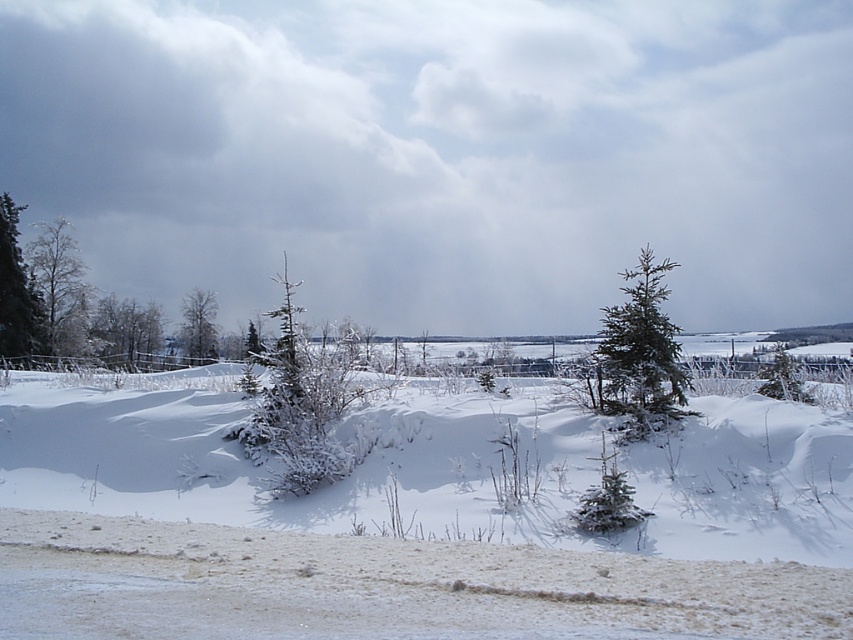
Does green frosted tree at left have a greater width compared to green matte evergreen tree at center-right?

Incorrect, green frosted tree at left's width does not surpass green matte evergreen tree at center-right's.

Who is higher up, green frosted tree at left or green matte evergreen tree at center-right?

Positioned higher is green matte evergreen tree at center-right.

Measure the distance between green frosted tree at left and camera.

green frosted tree at left is 70.23 feet from camera.

The height and width of the screenshot is (640, 853). Identify the location of green frosted tree at left. (128, 333).

Is snow-covered evergreen at center to the left of green matte tree at center from the viewer's perspective?

In fact, snow-covered evergreen at center is to the right of green matte tree at center.

Is snow-covered evergreen at center thinner than green matte tree at center?

No.

Does point (297, 362) come in front of point (209, 337)?

Yes, it is in front of point (209, 337).

At what (x,y) coordinates should I click in order to perform the action: click on snow-covered evergreen at center. Please return your answer as a coordinate pair (x, y). The width and height of the screenshot is (853, 640). Looking at the image, I should click on (297, 408).

Can you confirm if white snow at center is positioned above green frosted tree at left?

No, white snow at center is not above green frosted tree at left.

Between white snow at center and green frosted tree at left, which one is positioned lower?

white snow at center

Is point (723, 592) closer to camera compared to point (135, 332)?

That is True.

Identify the location of white snow at center. The height and width of the screenshot is (640, 853). (413, 516).